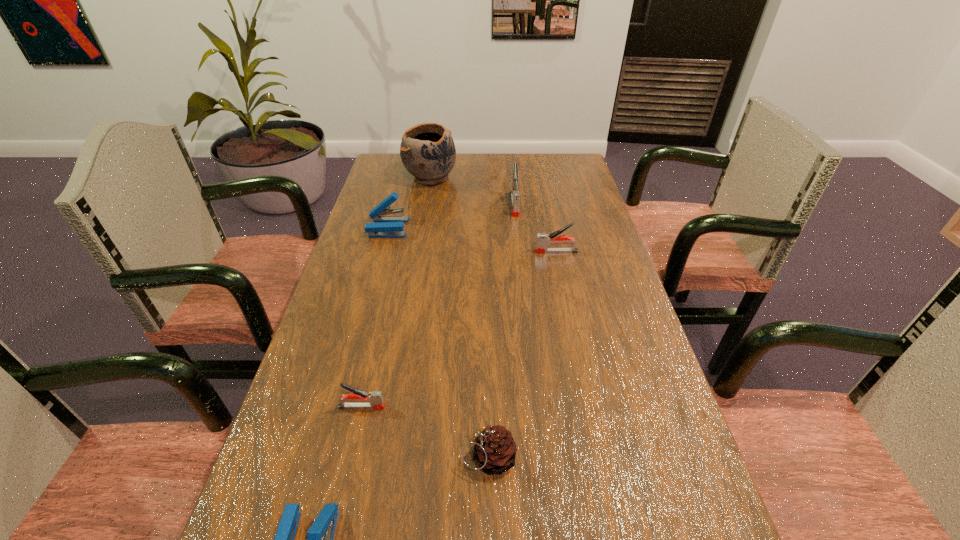
Where is `the farthest object`? This screenshot has height=540, width=960. the farthest object is located at coordinates (427, 151).

Where is `blue pottery`? The width and height of the screenshot is (960, 540). blue pottery is located at coordinates (427, 151).

At what (x,y) coordinates should I click in order to perform the action: click on the sixth object from left to right. Please return your answer as a coordinate pair (x, y). This screenshot has height=540, width=960. Looking at the image, I should click on [x=515, y=195].

This screenshot has width=960, height=540. I want to click on the biggest gray stapler, so click(x=515, y=195).

Find the location of a particular element. This screenshot has width=960, height=540. the rightmost stapler is located at coordinates (543, 240).

In order to click on the fourth nearest object in this screenshot , I will do `click(543, 240)`.

You are a GUI agent. You are given a task and a screenshot of the screen. Output one action in this format:
    pyautogui.click(x=<x>, y=<y>)
    Task: Click on the second farthest stapler
    
    Given the screenshot: What is the action you would take?
    pyautogui.click(x=387, y=226)

Find the location of `the farther blue stapler`. the farther blue stapler is located at coordinates (387, 226).

Where is `the second nearest object`? Image resolution: width=960 pixels, height=540 pixels. the second nearest object is located at coordinates (495, 450).

The height and width of the screenshot is (540, 960). I want to click on the fifth object from left to right, so click(x=495, y=450).